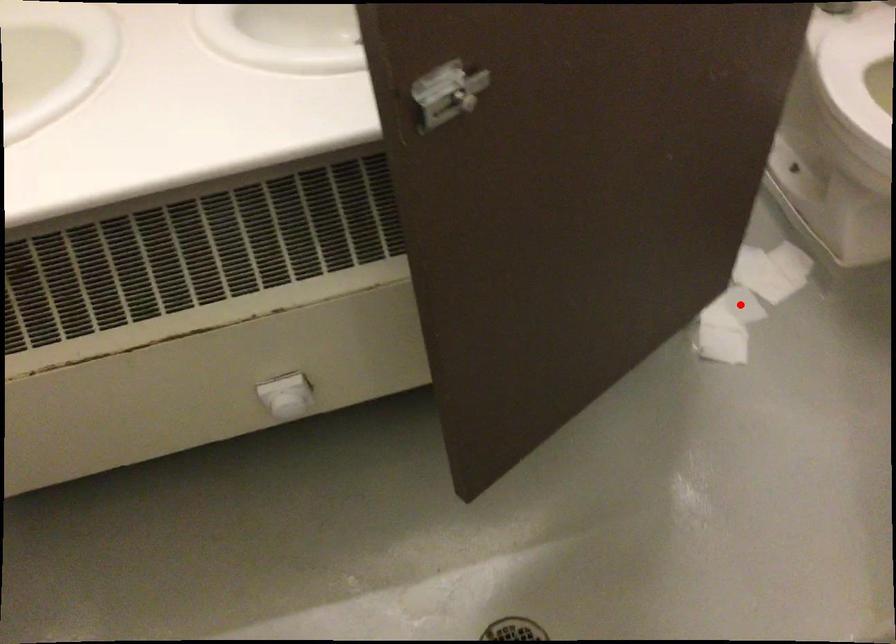
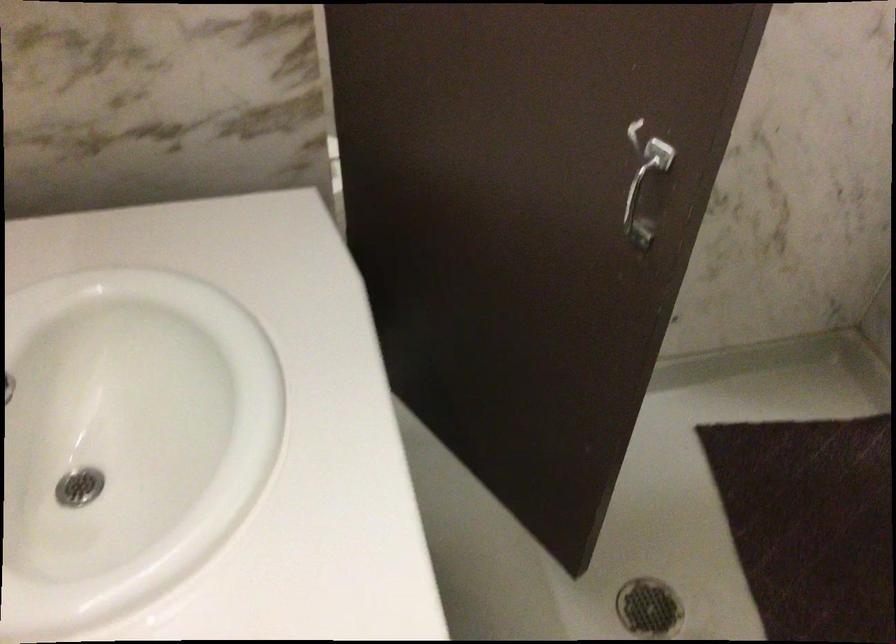
Question: I am providing you with two images of the same scene from different viewpoints. A red point is marked on the first image. Is the red point's position out of view in image 2?

Choices:
 (A) Yes
 (B) No

Answer: (A)